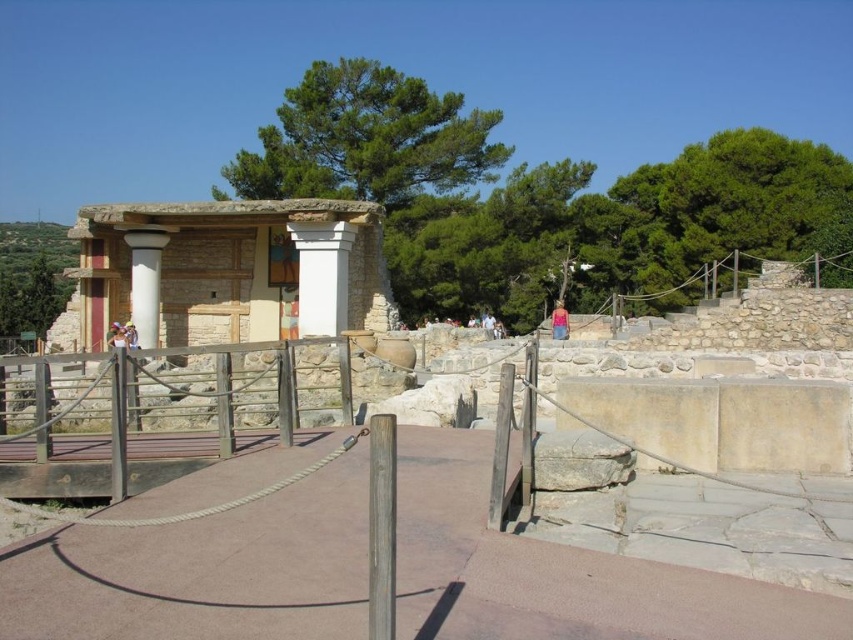
Question: Which object is the farthest from the blue denim shorts at center?

Choices:
 (A) white marble column at left
 (B) white stone column at center

Answer: (A)

Question: Observing the image, what is the correct spatial positioning of white stone amphitheater at center in reference to white stone column at center?

Choices:
 (A) below
 (B) above

Answer: (A)

Question: Which of the following is the farthest from the observer?

Choices:
 (A) (61, 576)
 (B) (561, 307)
 (C) (143, 264)

Answer: (B)

Question: Is white stone column at center to the left of blue denim shorts at center from the viewer's perspective?

Choices:
 (A) yes
 (B) no

Answer: (A)

Question: Where is white marble column at left located in relation to blue denim shorts at center in the image?

Choices:
 (A) left
 (B) right

Answer: (A)

Question: Among these objects, which one is nearest to the camera?

Choices:
 (A) white marble column at left
 (B) blue denim shorts at center
 (C) brown concrete path at center

Answer: (C)